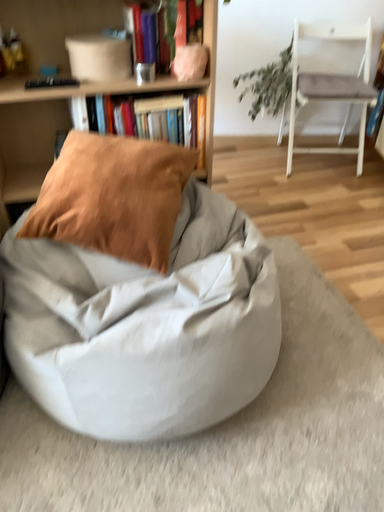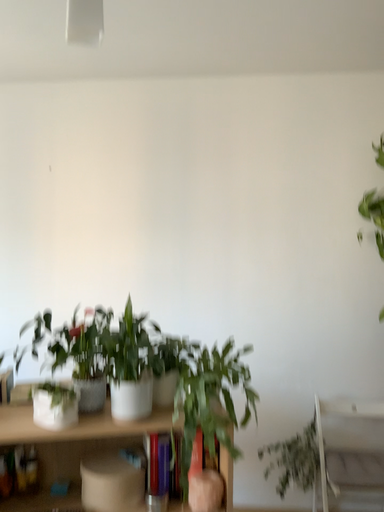
Question: Which way did the camera rotate in the video?

Choices:
 (A) rotated downward
 (B) rotated upward

Answer: (B)